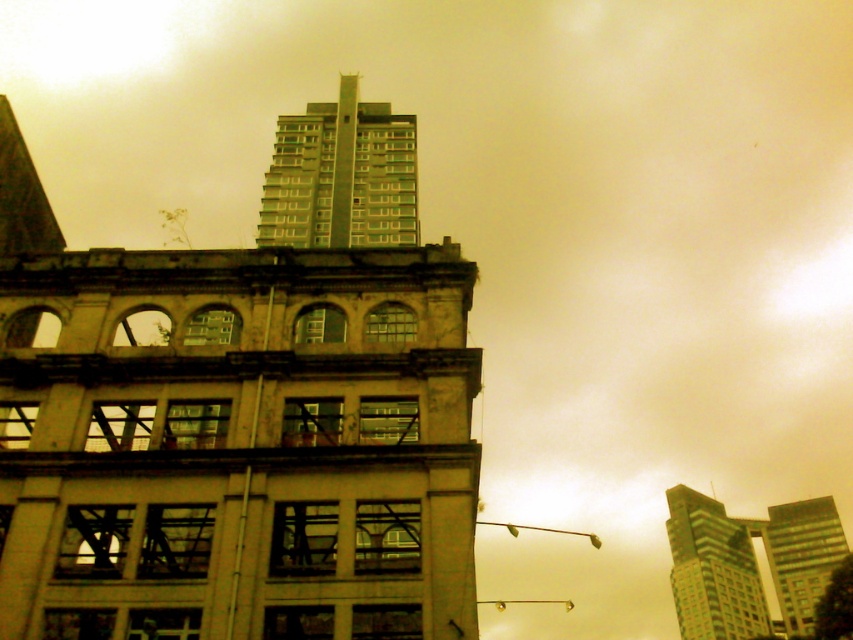
Who is shorter, green glass building at upper center or green glass building at upper right?

green glass building at upper right

Can you confirm if green glass building at upper center is positioned above green glass building at upper right?

Correct, green glass building at upper center is located above green glass building at upper right.

The width and height of the screenshot is (853, 640). What do you see at coordinates (341, 177) in the screenshot? I see `green glass building at upper center` at bounding box center [341, 177].

Locate an element on the screen. The width and height of the screenshot is (853, 640). green glass building at upper center is located at coordinates (341, 177).

Who is shorter, green glass building at upper right or green glass skyscraper at upper right?

green glass skyscraper at upper right is shorter.

Is point (729, 593) in front of point (810, 608)?

No, it is not.

Is point (733, 618) positioned after point (793, 532)?

That is False.

Locate an element on the screen. The height and width of the screenshot is (640, 853). green glass building at upper right is located at coordinates (712, 570).

Is green glass building at upper center shorter than green glass skyscraper at upper right?

Incorrect, green glass building at upper center's height does not fall short of green glass skyscraper at upper right's.

Between green glass building at upper center and green glass skyscraper at upper right, which one is positioned higher?

green glass building at upper center is higher up.

The image size is (853, 640). What do you see at coordinates (341, 177) in the screenshot? I see `green glass building at upper center` at bounding box center [341, 177].

This screenshot has width=853, height=640. I want to click on green glass building at upper center, so click(x=341, y=177).